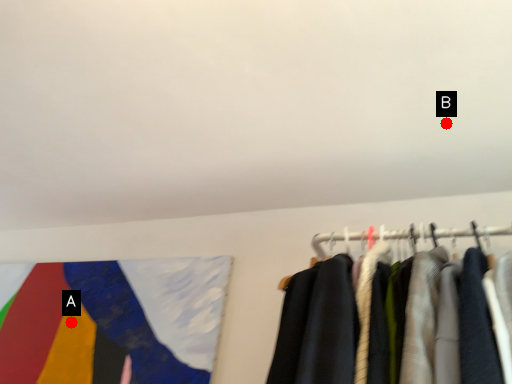
Question: Two points are circled on the image, labeled by A and B beside each circle. Which point is closer to the camera?

Choices:
 (A) A is closer
 (B) B is closer

Answer: (B)